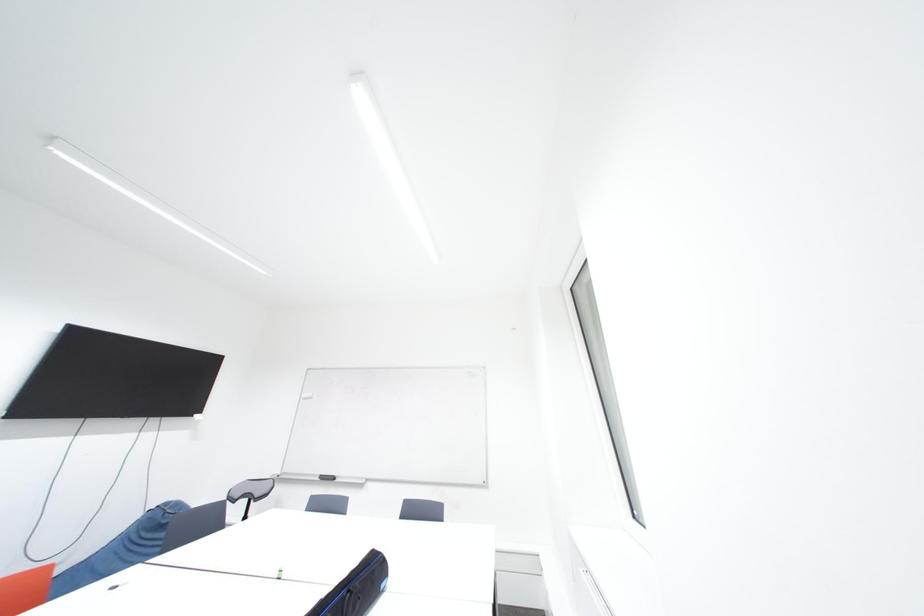
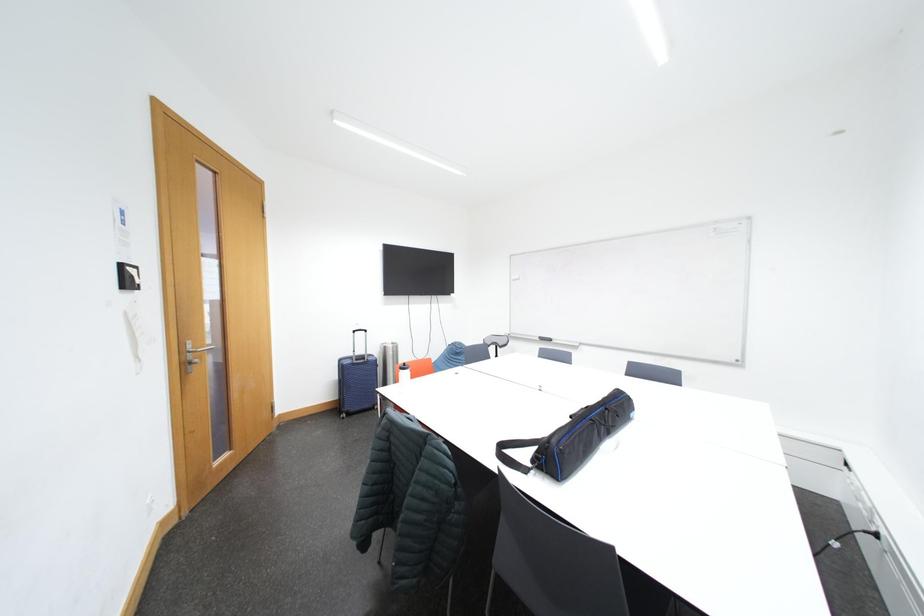
Based on the continuous images, in which direction is the camera rotating?

The rotation direction of the camera is left-down.